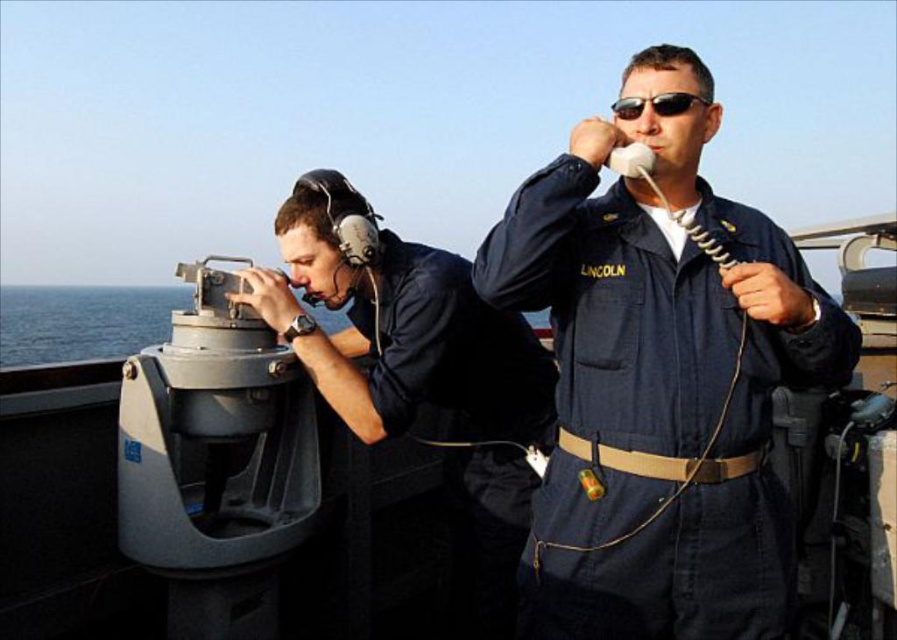
Please provide the 2D coordinates of the navy blue uniform at center in the image, using the coordinate system where the bottom left corner is the origin point.

The 2D coordinates of the navy blue uniform at center are at point (x=659, y=378).

You are a new crew member on the naval ship. You need to determine which object is shorter between the navy blue uniform at center and the matte black headset at left. Which one is shorter?

The navy blue uniform at center is shorter than the matte black headset at left according to the description.